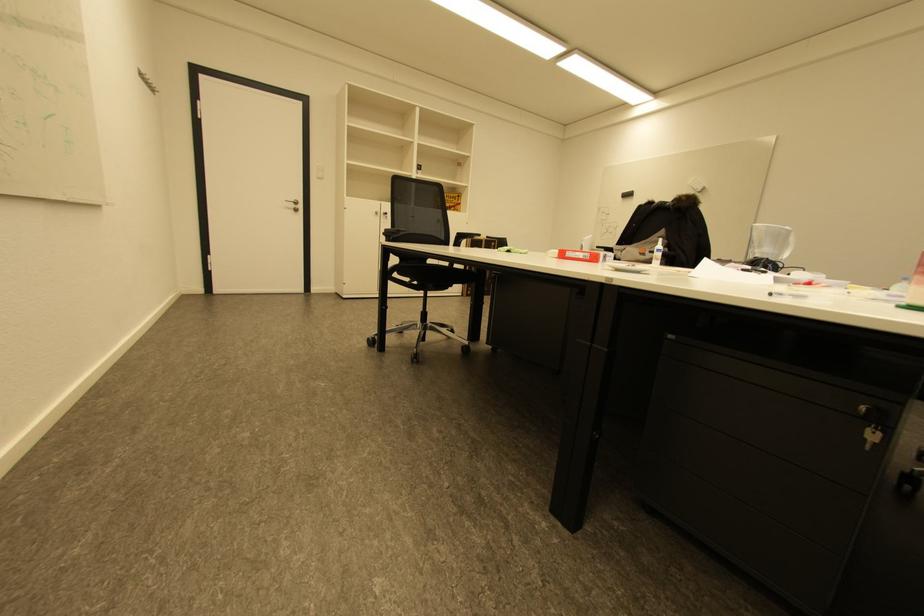
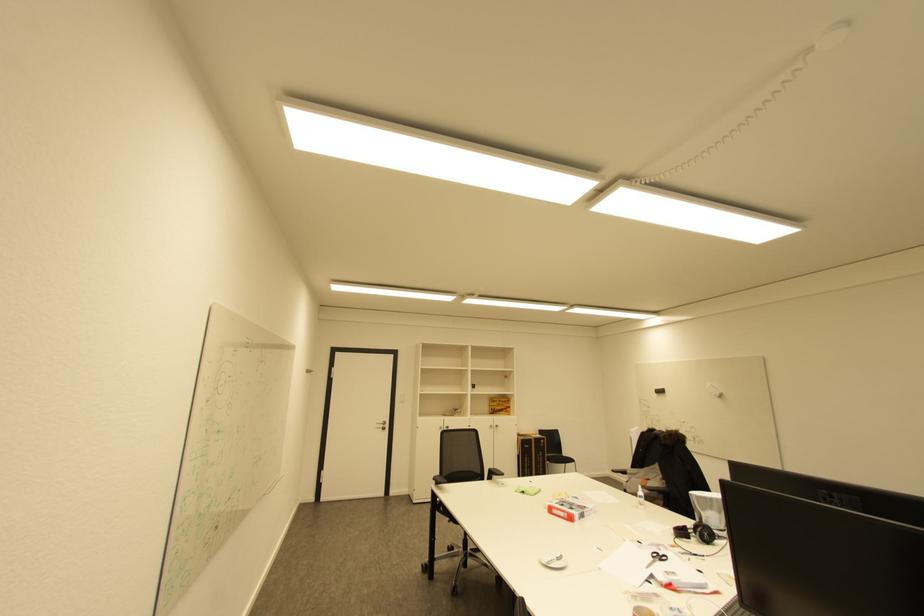
Locate, in the second image, the point that corresponds to point (768, 264) in the first image.

(704, 533)